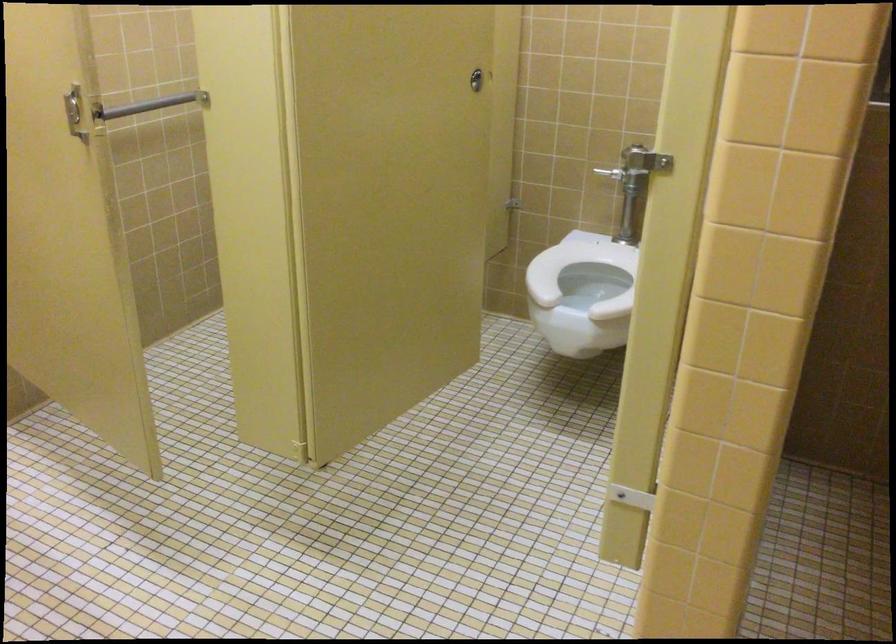
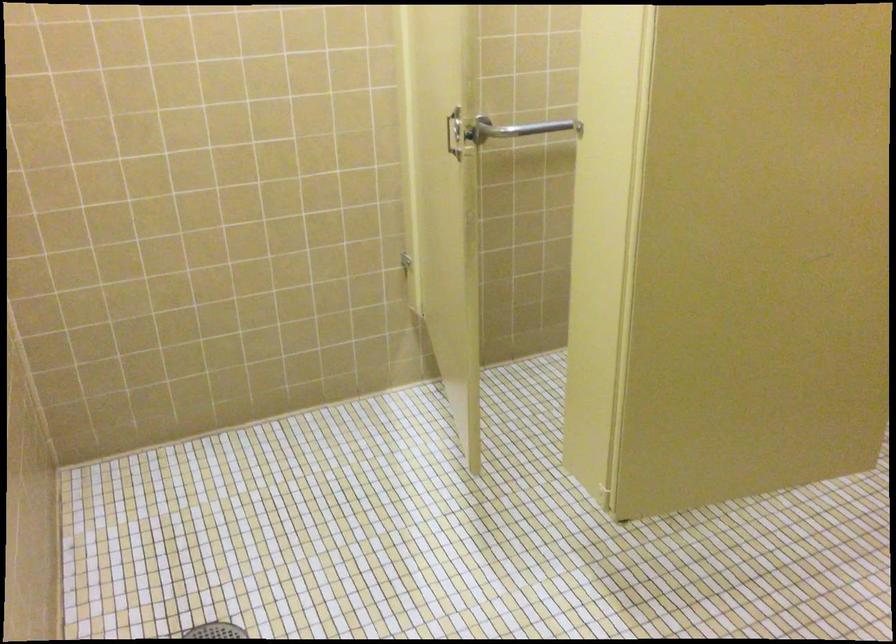
Question: The camera is either moving clockwise (left) or counter-clockwise (right) around the object. The first image is from the beginning of the video and the second image is from the end. Is the camera moving left or right when shooting the video?

Choices:
 (A) Left
 (B) Right

Answer: (B)